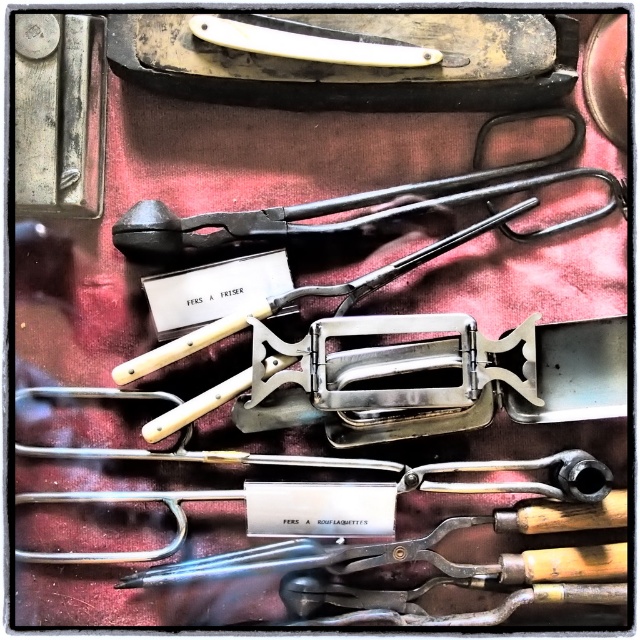
Please provide the coordinates of the black matte tongs at upper center in the image.

The black matte tongs at upper center are located at coordinates point (330, 204).

You are organizing a display of vintage tools and need to arrange them by height. Given that you have the black matte tongs at upper center and the metallic silver tool at center, which one should be placed first if you want to start with the shorter tool?

The black matte tongs at upper center should be placed first because it is not as tall as the metallic silver tool at center, making it the shorter of the two.

You are a craftsman working on a project and need to retrieve the metallic silver tool at center. However, the white plastic straight razor at upper center is blocking your access. Can you move the razor to reach the tool underneath?

The white plastic straight razor at upper center is positioned over the metallic silver tool at center, so yes, you can move the razor to access the tool underneath.